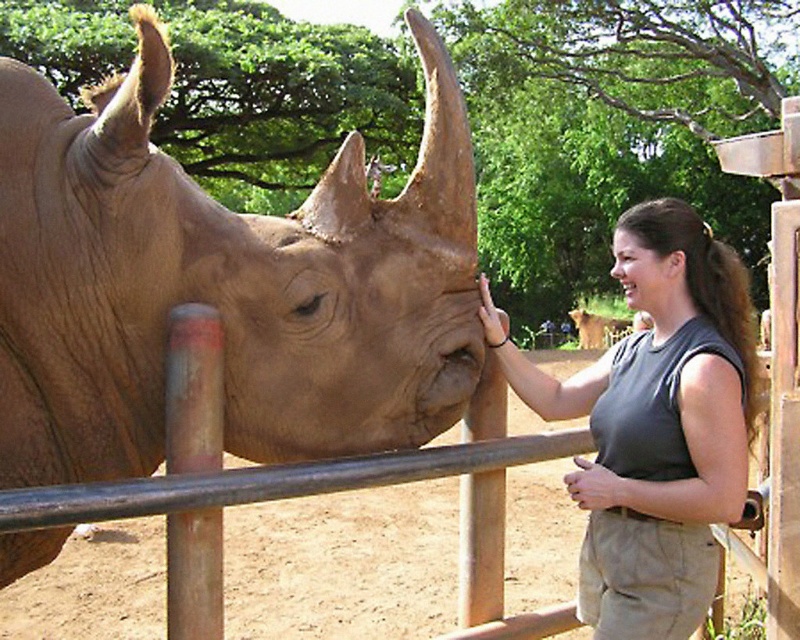
Question: Is smooth tan rhino at center smaller than gray fabric shirt at center?

Choices:
 (A) yes
 (B) no

Answer: (B)

Question: In this image, where is smooth tan rhino at center located relative to gray fabric shirt at center?

Choices:
 (A) right
 (B) left

Answer: (B)

Question: Which of the following is the closest to the observer?

Choices:
 (A) metal fence at center
 (B) smooth tan rhino at center
 (C) brown fur lion at center

Answer: (B)

Question: Among these objects, which one is farthest from the camera?

Choices:
 (A) gray fabric shirt at center
 (B) metal fence at center

Answer: (A)

Question: Which of these objects is positioned closest to the metal fence at center?

Choices:
 (A) brown fur lion at center
 (B) gray fabric shirt at center
 (C) smooth tan rhino at center

Answer: (C)

Question: Considering the relative positions of metal fence at center and brown fur lion at center in the image provided, where is metal fence at center located with respect to brown fur lion at center?

Choices:
 (A) right
 (B) left

Answer: (B)